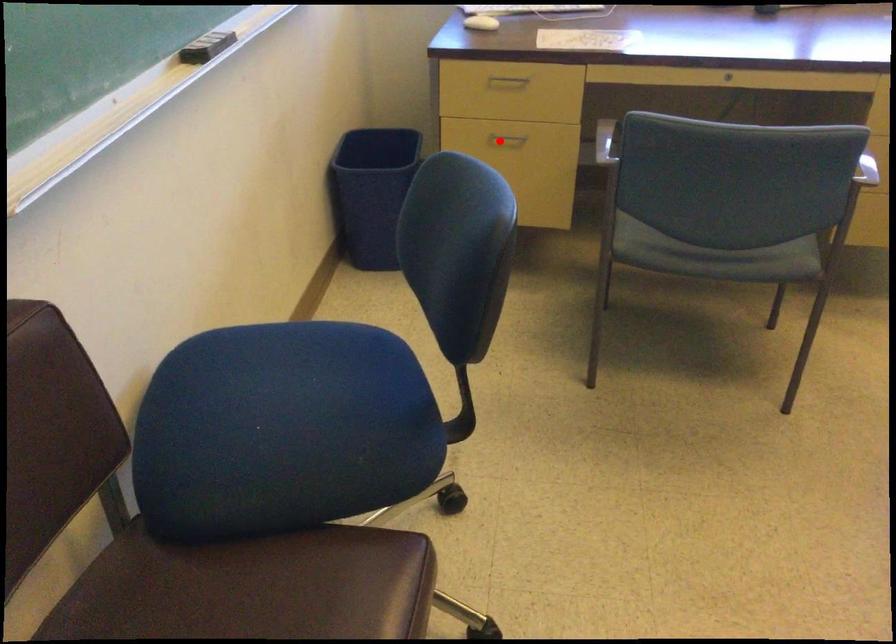
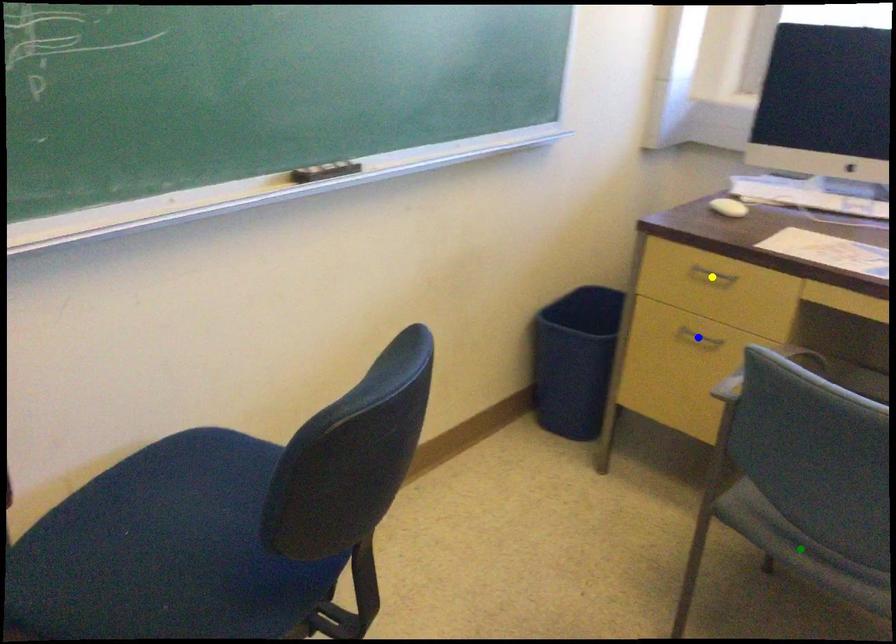
Question: I am providing you with two images of the same scene from different viewpoints. A red point is marked on the first image. You are given multiple points on the second image. Which point in image 2 represents the same 3d spot as the red point in image 1?

Choices:
 (A) yellow point
 (B) blue point
 (C) green point

Answer: (B)